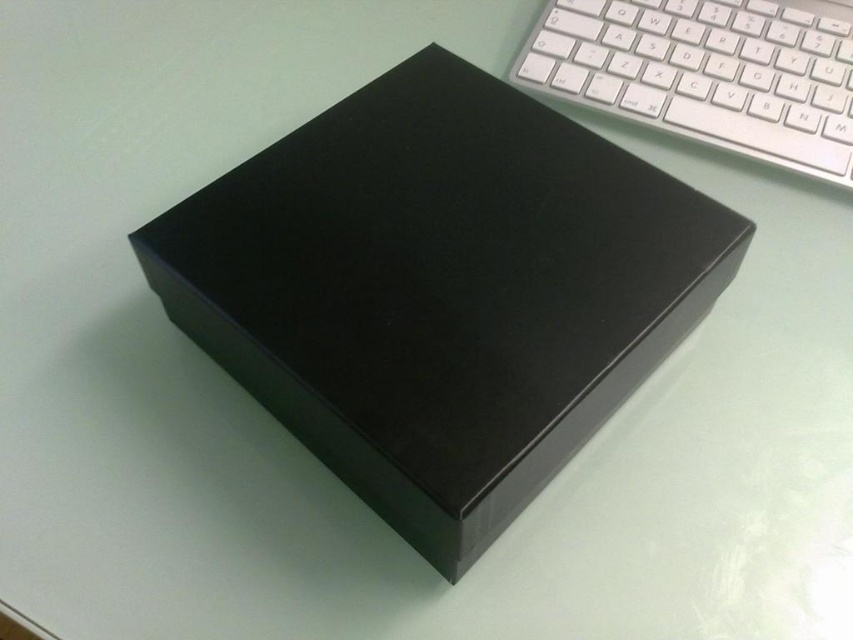
Is matte black box at center behind white plastic keyboard at upper right?

No, matte black box at center is in front of white plastic keyboard at upper right.

What do you see at coordinates (440, 291) in the screenshot? The width and height of the screenshot is (853, 640). I see `matte black box at center` at bounding box center [440, 291].

Between point (323, 272) and point (836, 54), which one is positioned behind?

The point (836, 54) is behind.

The height and width of the screenshot is (640, 853). Identify the location of matte black box at center. (440, 291).